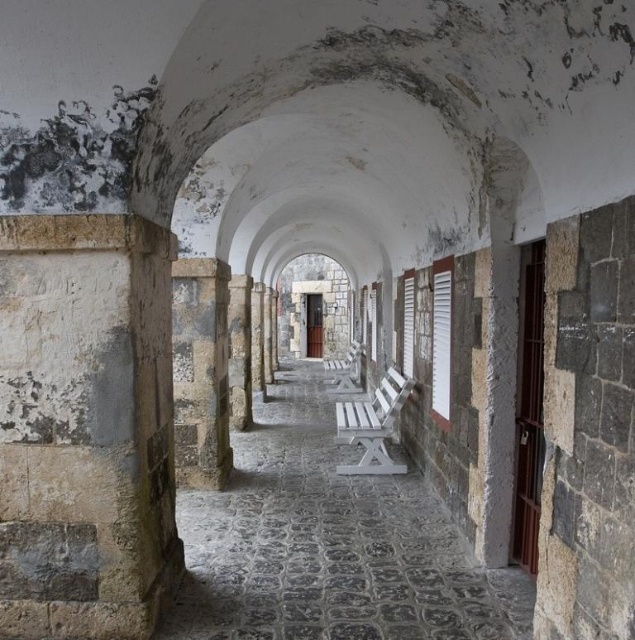
You are a tour guide leading a group through this historical corridor. You need to seat everyone on the white painted wood bench at center without blocking the stone textured pillar at center. Is the bench large enough to accommodate your group if the pillar takes up more space?

The white painted wood bench at center occupies less space than the stone textured pillar at center, so the bench is smaller in size. Therefore, if the pillar takes up more space, the bench might not be large enough to seat everyone without blocking the pillar.

You are a tour guide leading a group through this historical corridor. You need to ensure that your group can comfortably walk between the white painted wood bench at center and the stone textured pillar at center. The group requires a minimum of 2 meters of space to move. Can they pass through comfortably?

The white painted wood bench at center is 2.21 meters away from the stone textured pillar at center. Since the required minimum space is 2 meters, the group can comfortably pass through the space between them.

You are standing in the historical corridor and see a point marked at coordinates [330,544]. According to the image, where is this point located?

The point at coordinates [330,544] is located on the white painted wood bench at center.